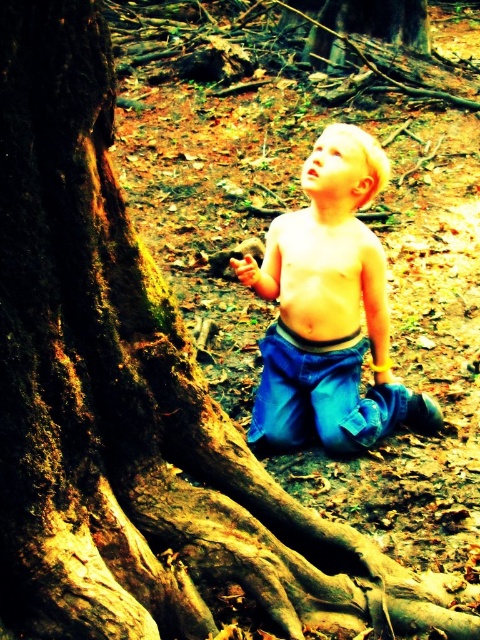
Question: Which object appears closest to the camera in this image?

Choices:
 (A) smooth skin torso at center
 (B) blue denim jeans at center

Answer: (B)

Question: Is blue denim jeans at center positioned in front of smooth skin torso at center?

Choices:
 (A) yes
 (B) no

Answer: (A)

Question: Does blue denim jeans at center have a larger size compared to smooth skin torso at center?

Choices:
 (A) yes
 (B) no

Answer: (A)

Question: Among these objects, which one is nearest to the camera?

Choices:
 (A) blue denim jeans at center
 (B) smooth skin torso at center

Answer: (A)

Question: Does blue denim jeans at center have a greater width compared to smooth skin torso at center?

Choices:
 (A) no
 (B) yes

Answer: (B)

Question: Among these objects, which one is nearest to the camera?

Choices:
 (A) smooth skin torso at center
 (B) blue denim jeans at center

Answer: (B)